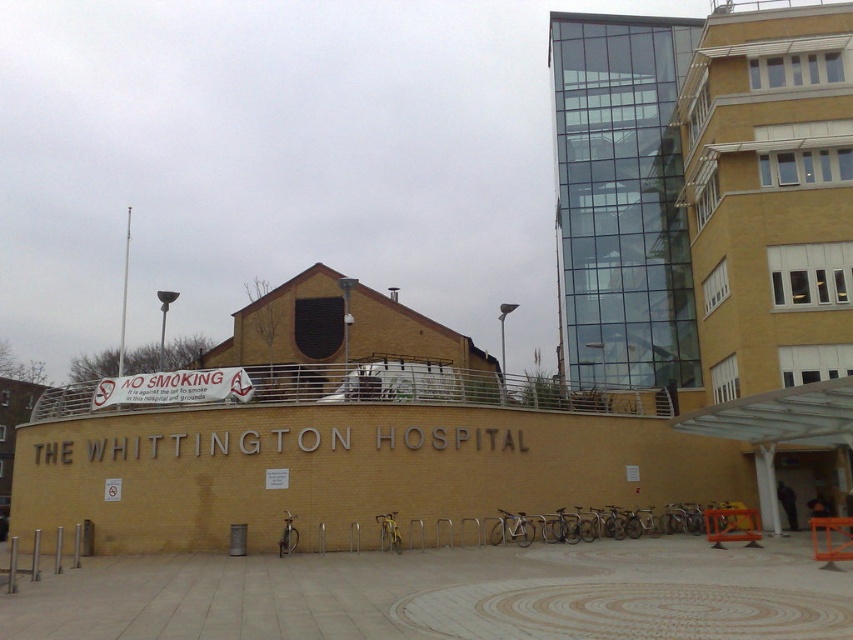
Can you confirm if silver metallic bicycle at lower center is shorter than yellow matte bicycle at center?

Yes, silver metallic bicycle at lower center is shorter than yellow matte bicycle at center.

Does silver metallic bicycle at lower center have a greater height compared to yellow matte bicycle at center?

Incorrect, silver metallic bicycle at lower center's height is not larger of yellow matte bicycle at center's.

What do you see at coordinates (648, 522) in the screenshot?
I see `silver metallic bicycle at lower center` at bounding box center [648, 522].

Find the location of `silver metallic bicycle at lower center`. silver metallic bicycle at lower center is located at coordinates (648, 522).

Describe the element at coordinates (511, 529) in the screenshot. I see `silver metallic bicycle at center` at that location.

Which is behind, point (509, 524) or point (398, 541)?

Positioned behind is point (509, 524).

The height and width of the screenshot is (640, 853). Describe the element at coordinates (511, 529) in the screenshot. I see `silver metallic bicycle at center` at that location.

Where is `silver metallic bicycle at center`? silver metallic bicycle at center is located at coordinates (511, 529).

Does point (671, 529) come in front of point (515, 516)?

That is False.

Who is higher up, silver metallic bicycle at lower center or silver metallic bicycle at center?

Positioned higher is silver metallic bicycle at center.

Does point (585, 531) come farther from viewer compared to point (518, 538)?

That is True.

This screenshot has width=853, height=640. I want to click on silver metallic bicycle at lower center, so click(x=648, y=522).